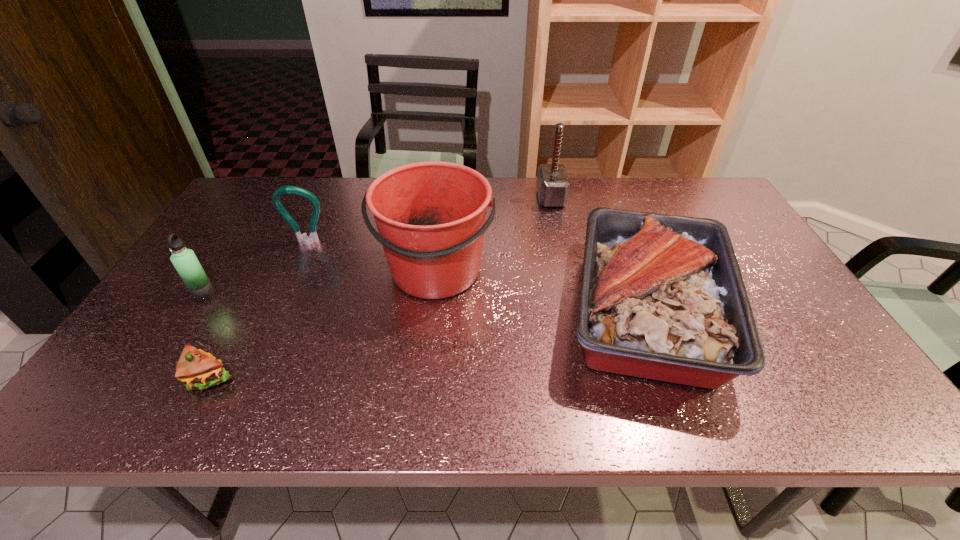
Locate an element on the screen. vacant space located on the left of the fifth tallest object is located at coordinates (516, 308).

Locate an element on the screen. The image size is (960, 540). vacant space located on the left of the shortest object is located at coordinates (115, 378).

At what (x,y) coordinates should I click in order to perform the action: click on object at the far edge. Please return your answer as a coordinate pair (x, y). The width and height of the screenshot is (960, 540). Looking at the image, I should click on (553, 184).

The height and width of the screenshot is (540, 960). I want to click on tray at the near edge, so click(662, 297).

The height and width of the screenshot is (540, 960). Find the location of `sandwich that is at the near edge`. sandwich that is at the near edge is located at coordinates (196, 369).

Locate an element on the screen. This screenshot has height=540, width=960. object that is at the left edge is located at coordinates (184, 260).

At what (x,y) coordinates should I click in order to perform the action: click on object located at the right edge. Please return your answer as a coordinate pair (x, y). Looking at the image, I should click on (662, 297).

Where is `object that is at the near right corner`? Image resolution: width=960 pixels, height=540 pixels. object that is at the near right corner is located at coordinates (662, 297).

Where is `vacant area at the far edge of the desktop`? The image size is (960, 540). vacant area at the far edge of the desktop is located at coordinates coord(645,185).

In the image, there is a desktop. Find the location of `free space at the near edge`. free space at the near edge is located at coordinates (720, 419).